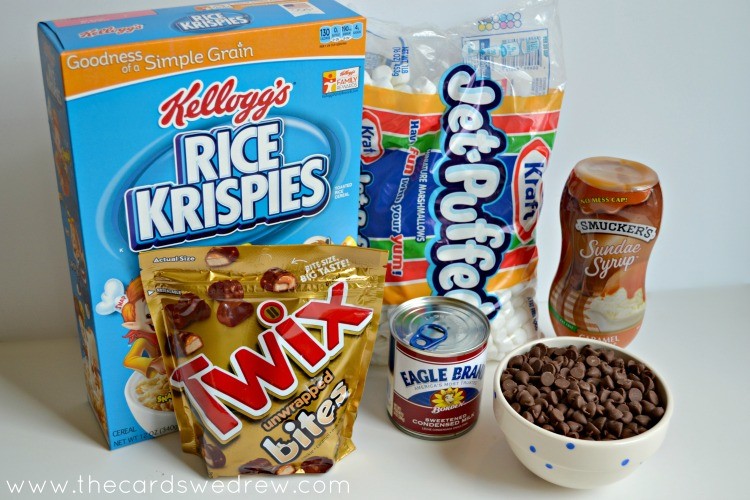
Find the location of a particular element. The width and height of the screenshot is (750, 500). box is located at coordinates (130, 147).